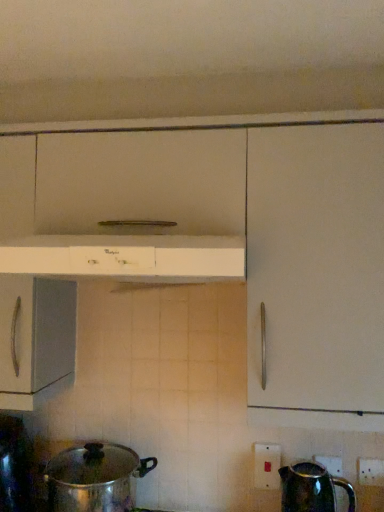
Question: Can you confirm if white glossy range hood at center is positioned to the left of shiny metallic pot at lower left?

Choices:
 (A) no
 (B) yes

Answer: (A)

Question: Is the position of white glossy range hood at center less distant than that of shiny metallic pot at lower left?

Choices:
 (A) no
 (B) yes

Answer: (B)

Question: From the image's perspective, is white glossy range hood at center over shiny metallic pot at lower left?

Choices:
 (A) yes
 (B) no

Answer: (A)

Question: Can you confirm if white glossy range hood at center is thinner than shiny metallic pot at lower left?

Choices:
 (A) no
 (B) yes

Answer: (A)

Question: Considering the relative sizes of white glossy range hood at center and shiny metallic pot at lower left in the image provided, is white glossy range hood at center taller than shiny metallic pot at lower left?

Choices:
 (A) no
 (B) yes

Answer: (A)

Question: Does white glossy range hood at center have a smaller size compared to shiny metallic pot at lower left?

Choices:
 (A) yes
 (B) no

Answer: (B)

Question: Does shiny metallic pot at lower left have a larger size compared to white plastic electric outlet at lower right, the 1th electric outlet when ordered from right to left?

Choices:
 (A) no
 (B) yes

Answer: (B)

Question: Considering the relative sizes of shiny metallic pot at lower left and white plastic electric outlet at lower right, which appears as the second electric outlet when viewed from the left, in the image provided, is shiny metallic pot at lower left thinner than white plastic electric outlet at lower right, which appears as the second electric outlet when viewed from the left,?

Choices:
 (A) no
 (B) yes

Answer: (A)

Question: Is the depth of shiny metallic pot at lower left greater than that of white plastic electric outlet at lower right, the 2th electric outlet from the back?

Choices:
 (A) no
 (B) yes

Answer: (A)

Question: Is shiny metallic pot at lower left not inside white plastic electric outlet at lower right, the 1th electric outlet when ordered from right to left?

Choices:
 (A) yes
 (B) no

Answer: (A)

Question: Is shiny metallic pot at lower left oriented towards white plastic electric outlet at lower right, which is counted as the 1th electric outlet, starting from the front?

Choices:
 (A) no
 (B) yes

Answer: (A)

Question: From the image's perspective, is shiny metallic pot at lower left on white plastic electric outlet at lower right, which appears as the second electric outlet when viewed from the left?

Choices:
 (A) no
 (B) yes

Answer: (A)

Question: Does white plastic electric outlet at lower right, which ranks as the first electric outlet in back-to-front order, have a lesser width compared to white plastic electric outlet at lower right, the 1th electric outlet when ordered from right to left?

Choices:
 (A) no
 (B) yes

Answer: (A)